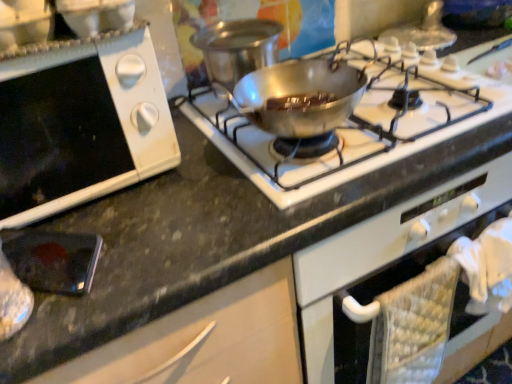
Identify the location of vacant point to the right of metallic silver phone at lower left. (168, 246).